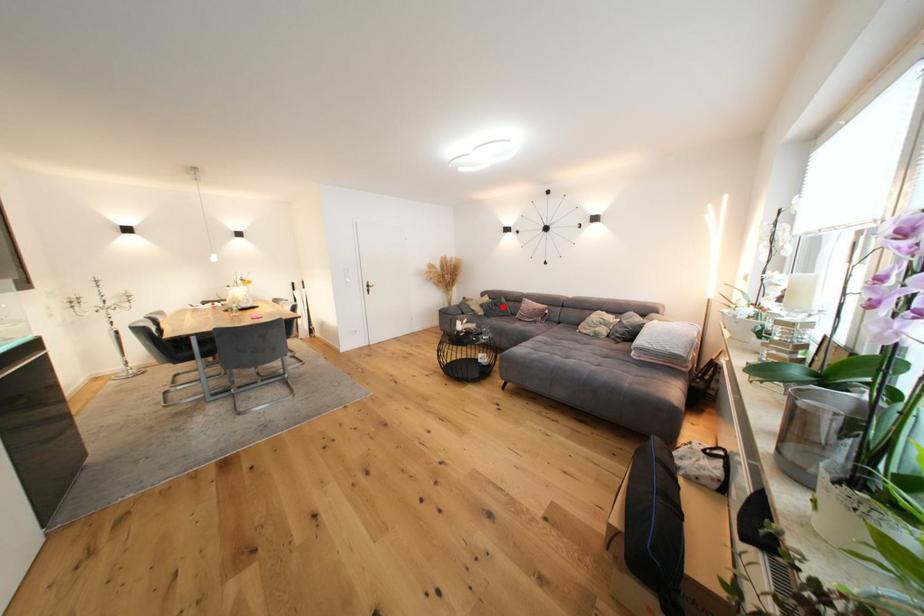
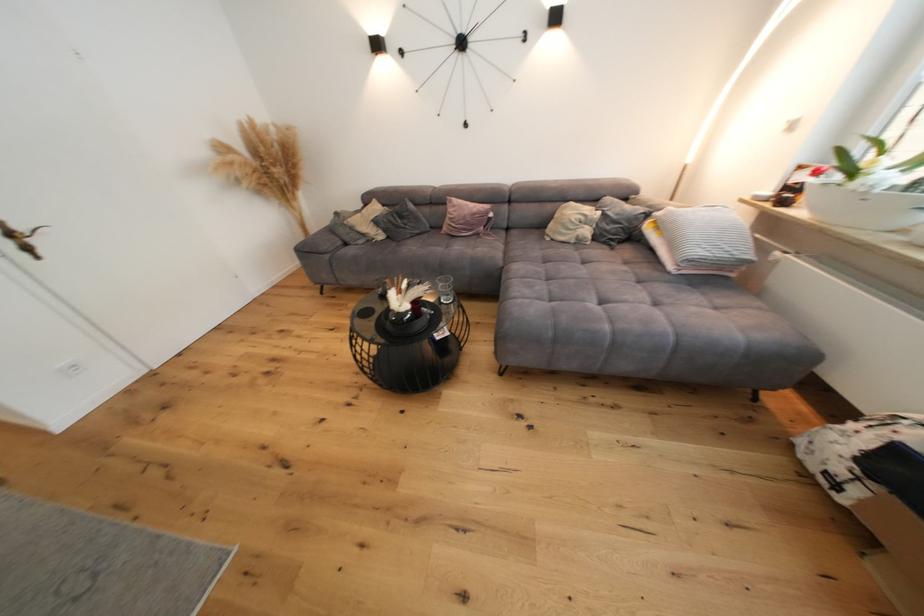
Question: I am providing you with two images of the same scene from different viewpoints. Given a red point in image1, look at the same physical point in image2. Is it:

Choices:
 (A) Closer to the viewpoint
 (B) Farther from the viewpoint

Answer: (A)